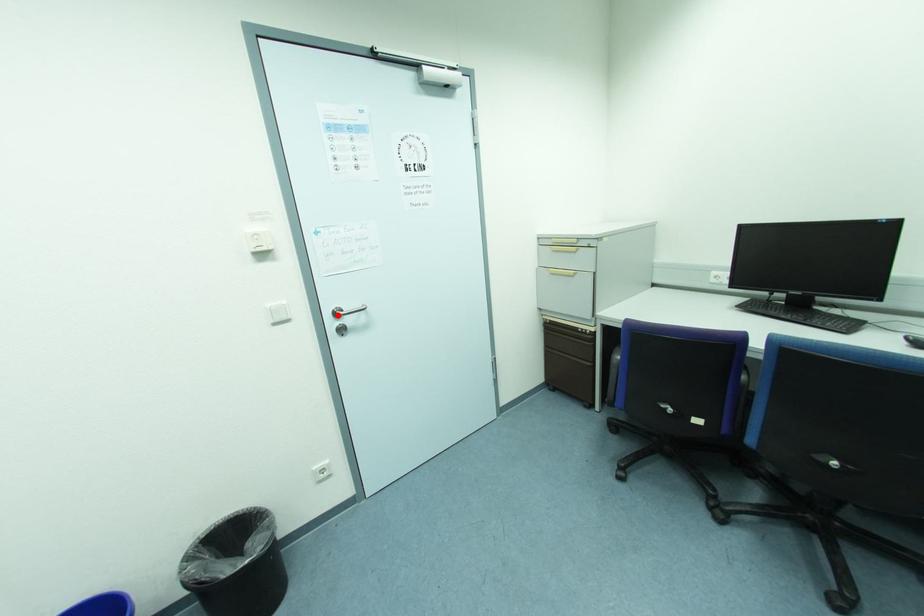
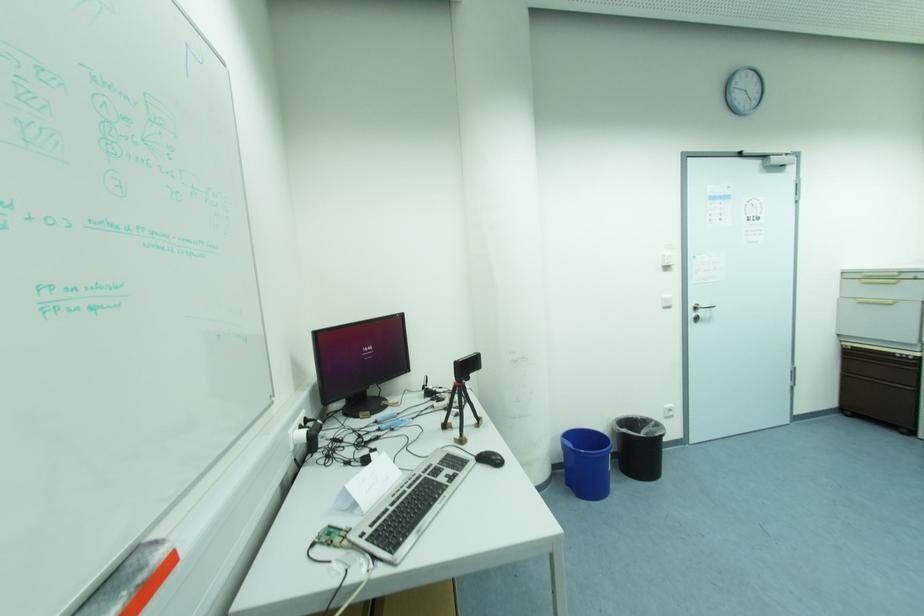
Locate, in the second image, the point that corresponds to the highlighted location in the first image.

(697, 309)